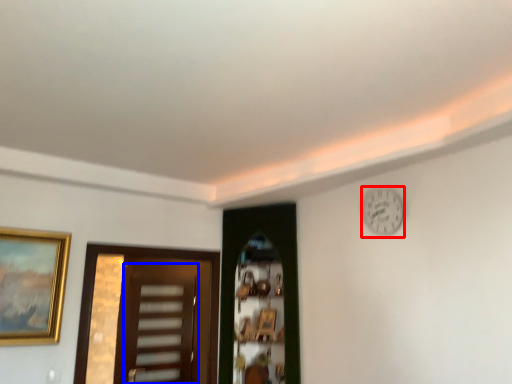
Question: Which object is closer to the camera taking this photo, clock (highlighted by a red box) or screen door (highlighted by a blue box)?

Choices:
 (A) clock
 (B) screen door

Answer: (A)